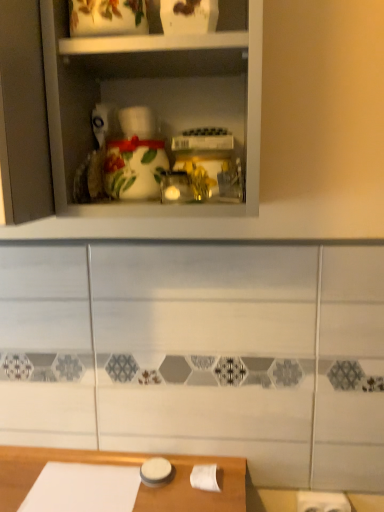
Locate an element on the screen. white glossy vase at upper center is located at coordinates coord(157,106).

What do you see at coordinates (157, 106) in the screenshot? I see `white glossy vase at upper center` at bounding box center [157, 106].

Where is `white glossy vase at upper center`? The height and width of the screenshot is (512, 384). white glossy vase at upper center is located at coordinates (157, 106).